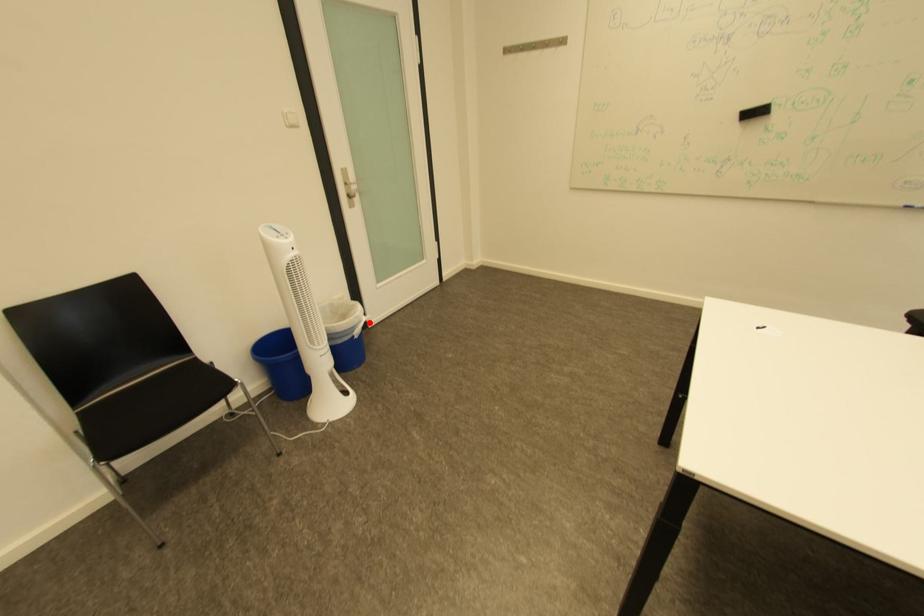
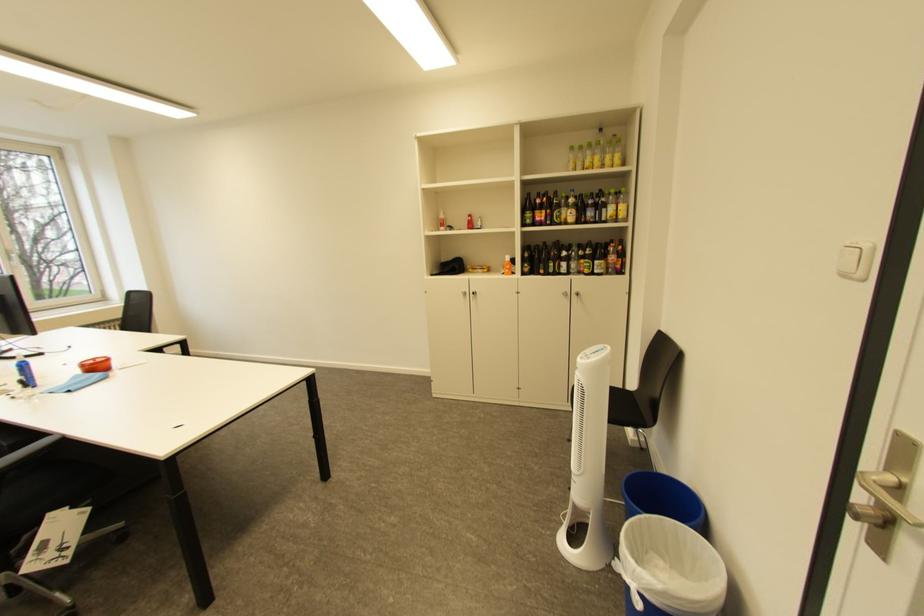
The point at the highlighted location is marked in the first image. Where is the corresponding point in the second image?

(636, 570)